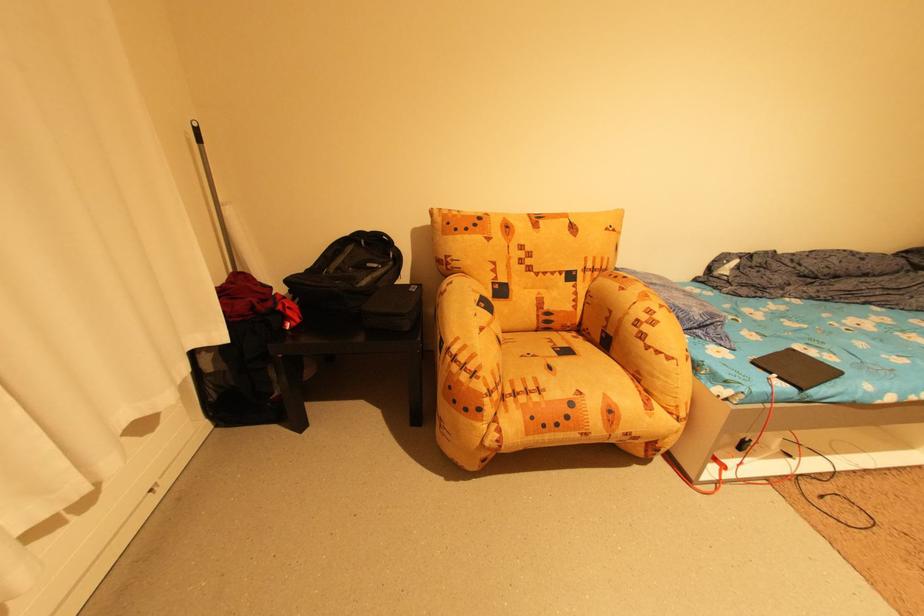
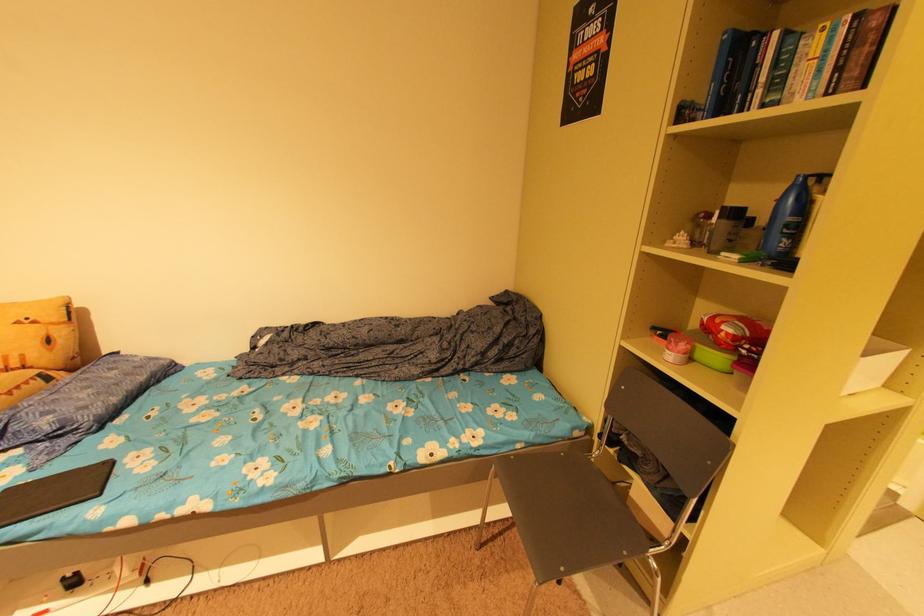
Find the pixel in the second image that matches (x=614, y=230) in the first image.

(23, 323)